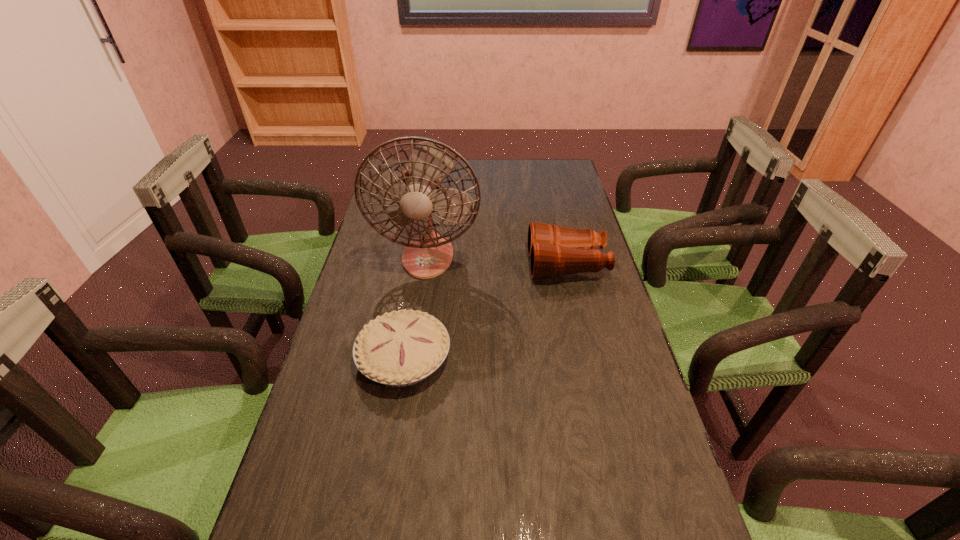
Find the location of a particular element. This screenshot has width=960, height=540. fan is located at coordinates (428, 254).

This screenshot has height=540, width=960. What are the coordinates of `the rightmost object` in the screenshot? It's located at (554, 251).

Image resolution: width=960 pixels, height=540 pixels. In order to click on binoculars in this screenshot , I will do (x=554, y=251).

Identify the location of the shortest object. click(x=400, y=348).

Where is `the nearest object`? This screenshot has height=540, width=960. the nearest object is located at coordinates (400, 348).

Find the location of `blank area located 0.260m in front of the tallest object to direct airflow`. blank area located 0.260m in front of the tallest object to direct airflow is located at coordinates (414, 351).

Identify the location of vacant space positioned 0.380m through the lenses of the binoculars. (407, 265).

You are a GUI agent. You are given a task and a screenshot of the screen. Output one action in this format:
    pyautogui.click(x=<x>, y=<y>)
    Task: Click on the free location located 0.200m through the lenses of the binoculars
    
    Given the screenshot: What is the action you would take?
    pyautogui.click(x=465, y=265)

The height and width of the screenshot is (540, 960). I want to click on free spot located through the lenses of the binoculars, so click(x=433, y=265).

At what (x,y) coordinates should I click in order to perform the action: click on vacant position located on the left of the shortest object. Please return your answer as a coordinate pair (x, y). Looking at the image, I should click on (333, 357).